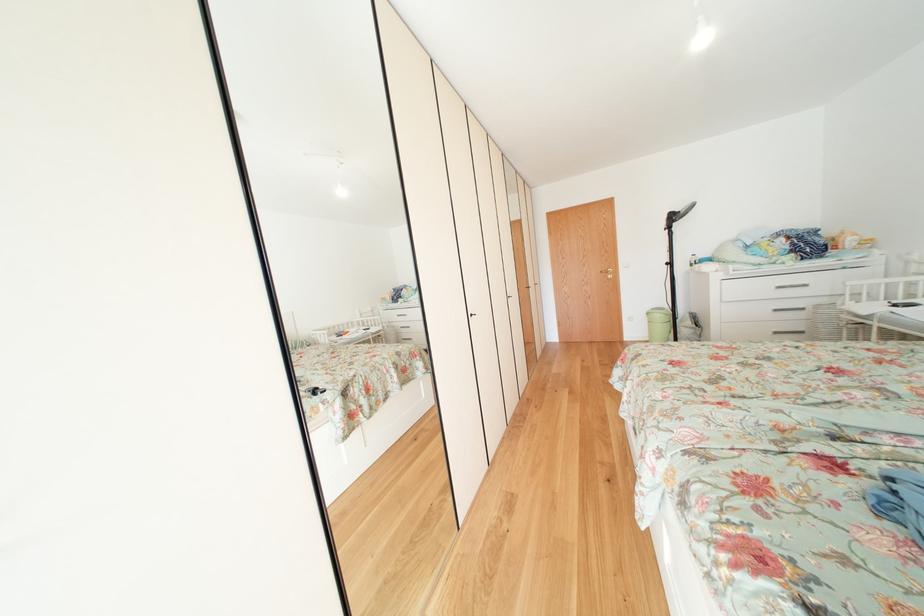
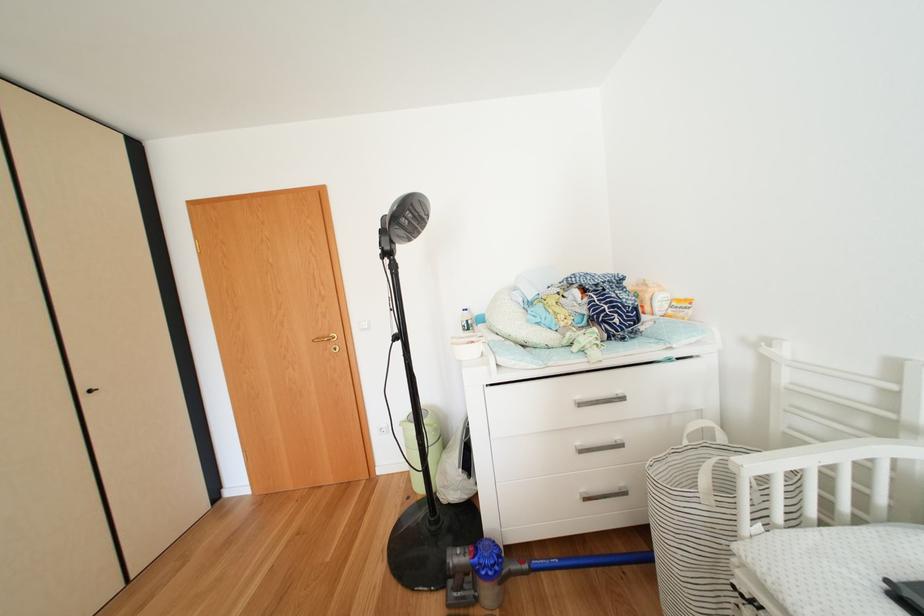
Question: I am providing you with two images of the same scene from different viewpoints. After the viewpoint changes to image2, which objects are now occluded?

Choices:
 (A) grey curtain edge
 (B) black cabinet handle
 (C) gold door handle
 (D) green trash can

Answer: (D)